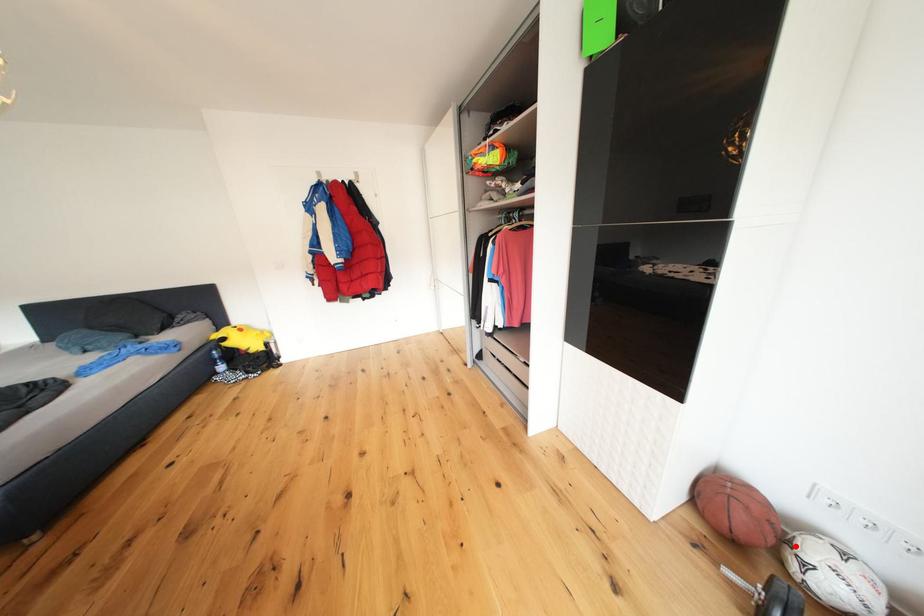
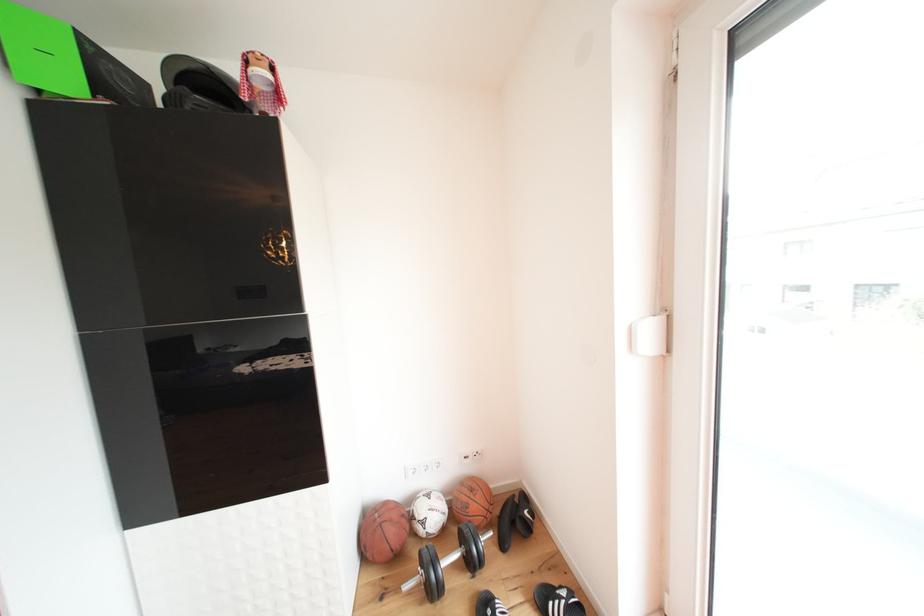
In the second image, find the point that corresponds to the highlighted location in the first image.

(420, 523)